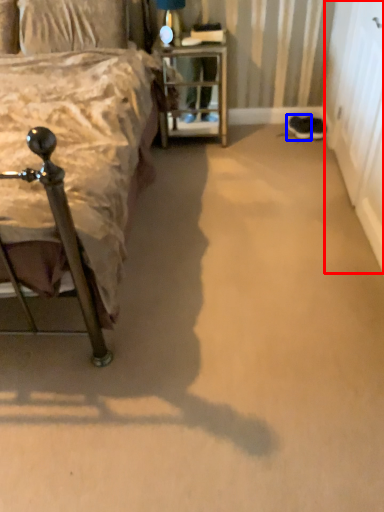
Question: Which object is further to the camera taking this photo, screen door (highlighted by a red box) or footwear (highlighted by a blue box)?

Choices:
 (A) screen door
 (B) footwear

Answer: (B)